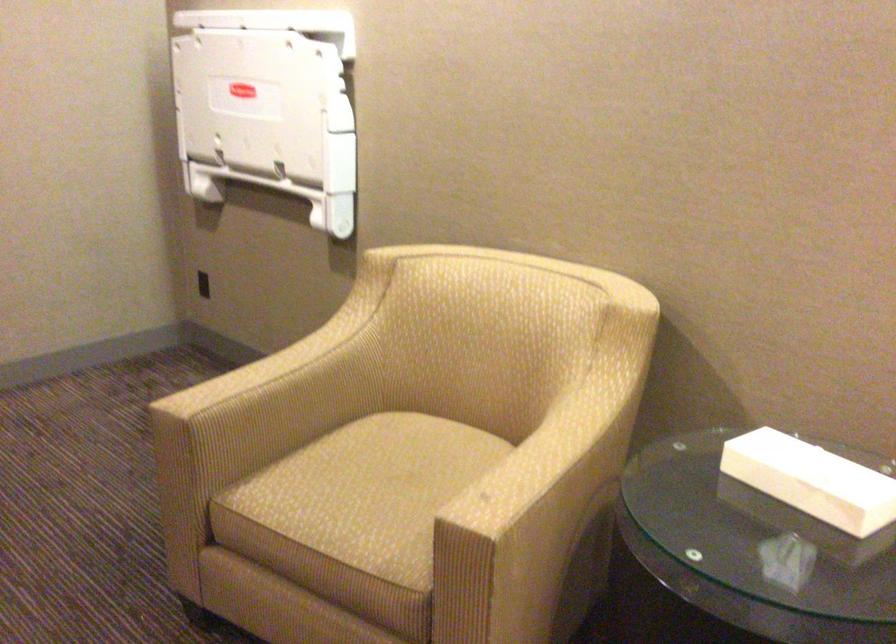
At what (x,y) coordinates should I click in order to perform the action: click on changing station handle. Please return your answer as a coordinate pair (x, y). Looking at the image, I should click on (248, 187).